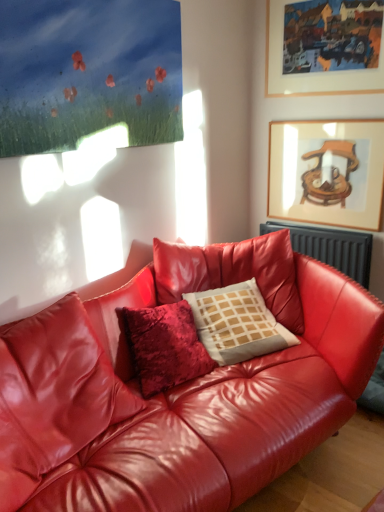
Question: From the image's perspective, does black metallic radiator at upper right appear higher than white textured pillow at center?

Choices:
 (A) no
 (B) yes

Answer: (B)

Question: Is black metallic radiator at upper right taller than white textured pillow at center?

Choices:
 (A) yes
 (B) no

Answer: (B)

Question: Does black metallic radiator at upper right have a lesser width compared to white textured pillow at center?

Choices:
 (A) no
 (B) yes

Answer: (B)

Question: Would you consider black metallic radiator at upper right to be distant from white textured pillow at center?

Choices:
 (A) no
 (B) yes

Answer: (A)

Question: Can you confirm if black metallic radiator at upper right is shorter than white textured pillow at center?

Choices:
 (A) yes
 (B) no

Answer: (A)

Question: Is shiny red leather couch at center in front of or behind matte wooden picture frame at upper right, which ranks as the second picture frame in top-to-bottom order, in the image?

Choices:
 (A) front
 (B) behind

Answer: (A)

Question: In terms of size, does shiny red leather couch at center appear bigger or smaller than matte wooden picture frame at upper right, which ranks as the second picture frame in top-to-bottom order?

Choices:
 (A) small
 (B) big

Answer: (B)

Question: From the image's perspective, is shiny red leather couch at center above or below matte wooden picture frame at upper right, which is counted as the first picture frame, starting from the bottom?

Choices:
 (A) above
 (B) below

Answer: (B)

Question: Is shiny red leather couch at center inside the boundaries of matte wooden picture frame at upper right, which is counted as the first picture frame, starting from the bottom, or outside?

Choices:
 (A) outside
 (B) inside

Answer: (A)

Question: From the image's perspective, is shiny red leather couch at center above or below black metallic radiator at upper right?

Choices:
 (A) above
 (B) below

Answer: (B)

Question: Is shiny red leather couch at center inside the boundaries of black metallic radiator at upper right, or outside?

Choices:
 (A) inside
 (B) outside

Answer: (B)

Question: In the image, is shiny red leather couch at center on the left side or the right side of black metallic radiator at upper right?

Choices:
 (A) right
 (B) left

Answer: (B)

Question: Is shiny red leather couch at center wider or thinner than black metallic radiator at upper right?

Choices:
 (A) wide
 (B) thin

Answer: (A)

Question: From a real-world perspective, is wooden-framed painting at upper right, placed as the second picture frame when sorted from bottom to top, positioned above or below shiny red leather couch at center?

Choices:
 (A) below
 (B) above

Answer: (B)

Question: Which is correct: wooden-framed painting at upper right, the 1th picture frame when ordered from top to bottom, is inside shiny red leather couch at center, or outside of it?

Choices:
 (A) outside
 (B) inside

Answer: (A)